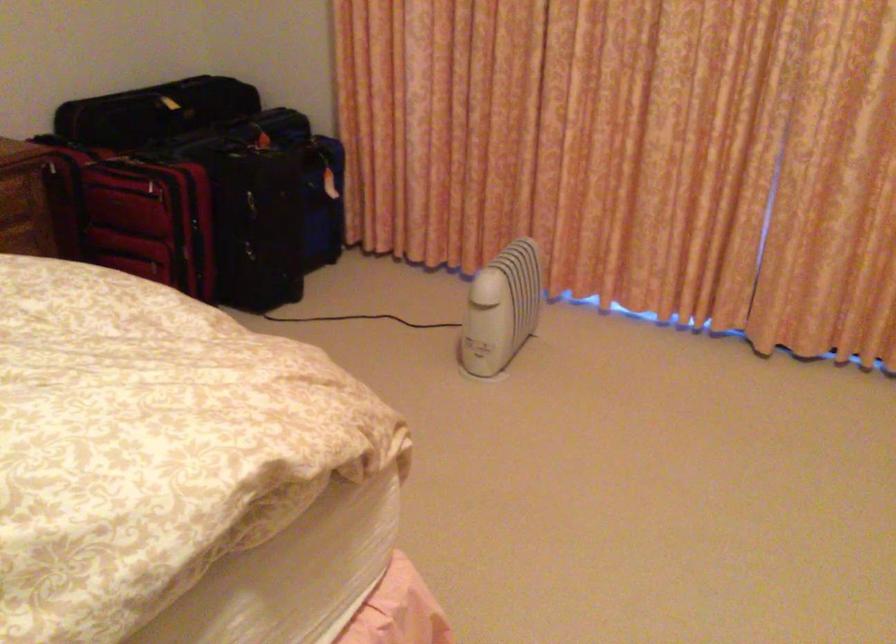
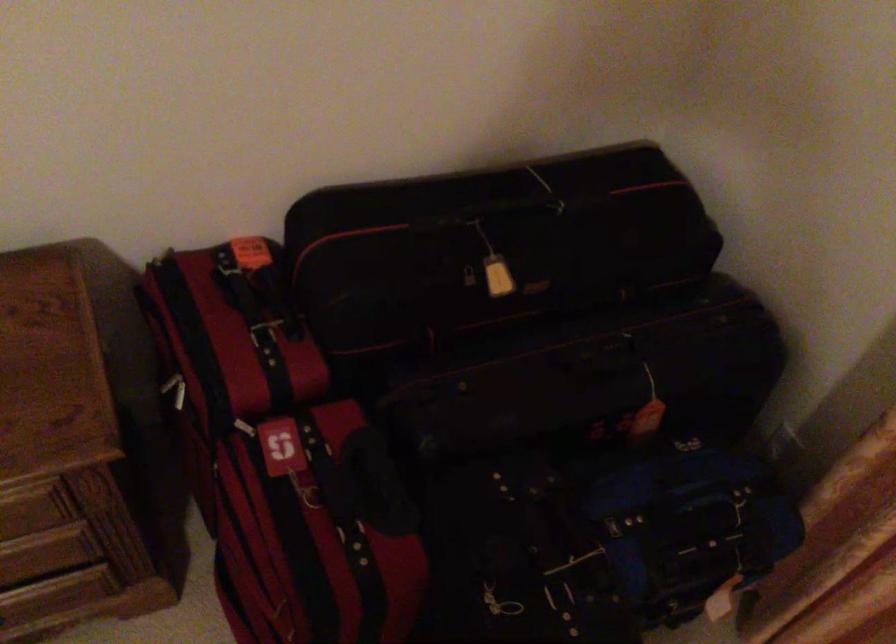
In the second image, find the point that corresponds to (254,152) in the first image.

(556, 552)